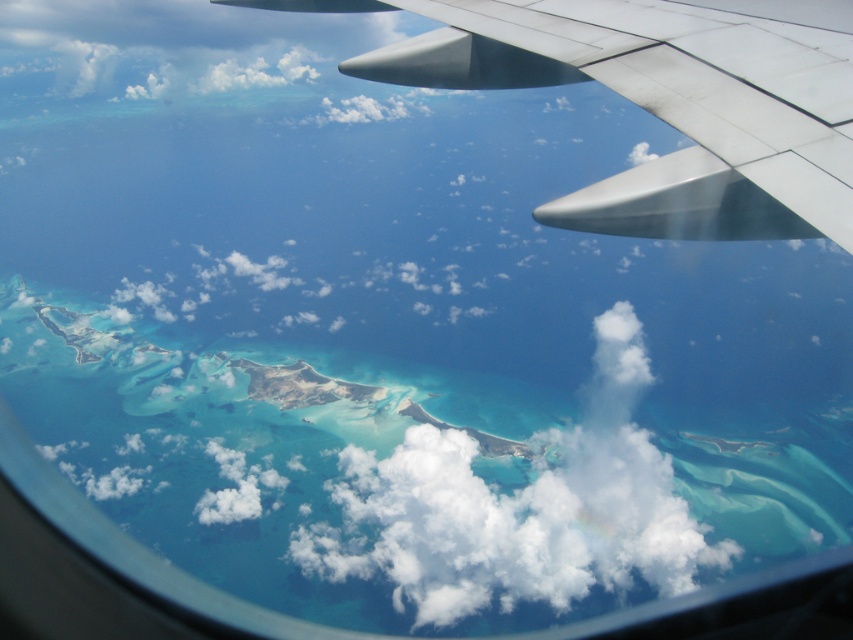
You are a passenger on the airplane and notice the metallic silver wing at upper right and the white fluffy cloud at center. Which object takes up more space in the window view?

The white fluffy cloud at center takes up more space in the window view than the metallic silver wing at upper right.

You are a passenger on the airplane and want to take a photo of the tropical island. You notice the metallic silver wing at upper right and the white fluffy cloud at center. Which object is closer to the left side of the airplane window?

The metallic silver wing at upper right is closer to the left side of the airplane window than the white fluffy cloud at center because the metallic silver wing at upper right is to the left of white fluffy cloud at center.